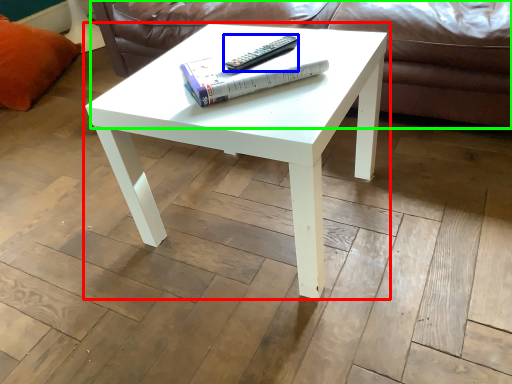
Question: Which is nearer to the coffee table (highlighted by a red box)? remote (highlighted by a blue box) or couch (highlighted by a green box).

Choices:
 (A) remote
 (B) couch

Answer: (A)